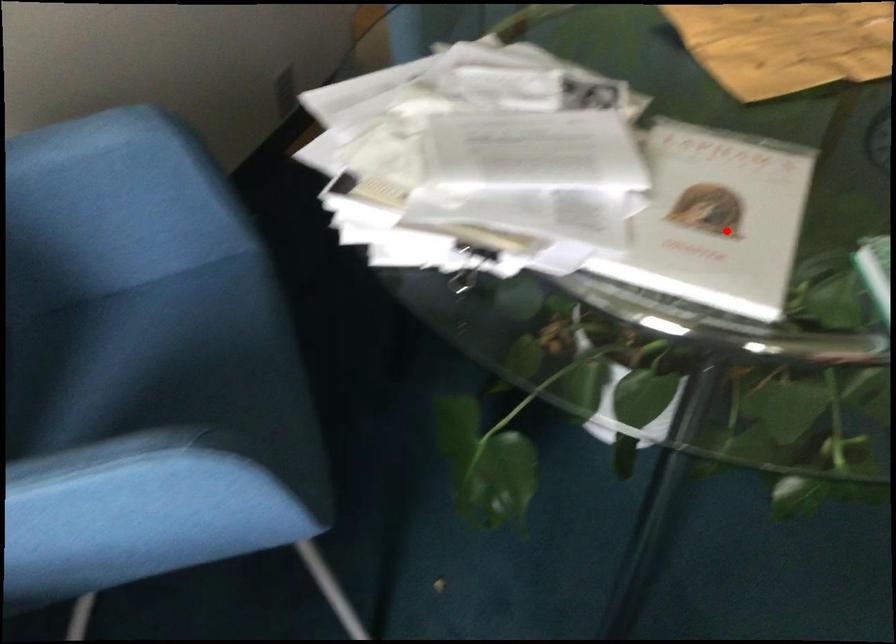
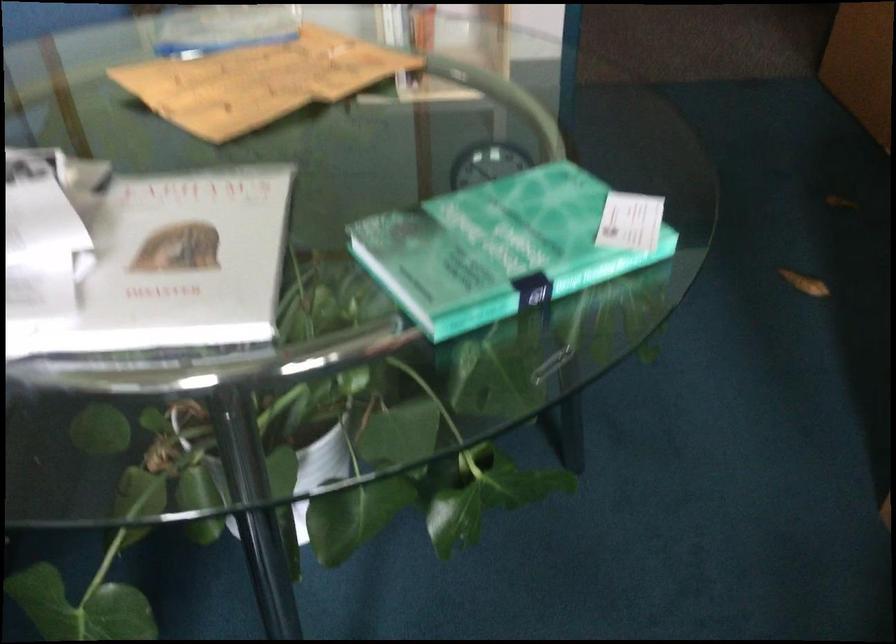
Locate, in the second image, the point that corresponds to the highlighted location in the first image.

(186, 259)